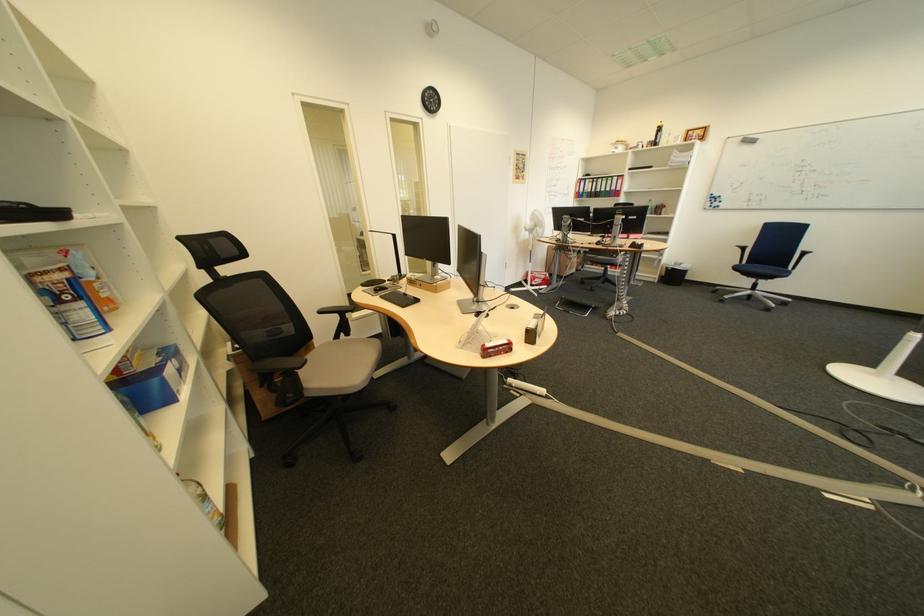
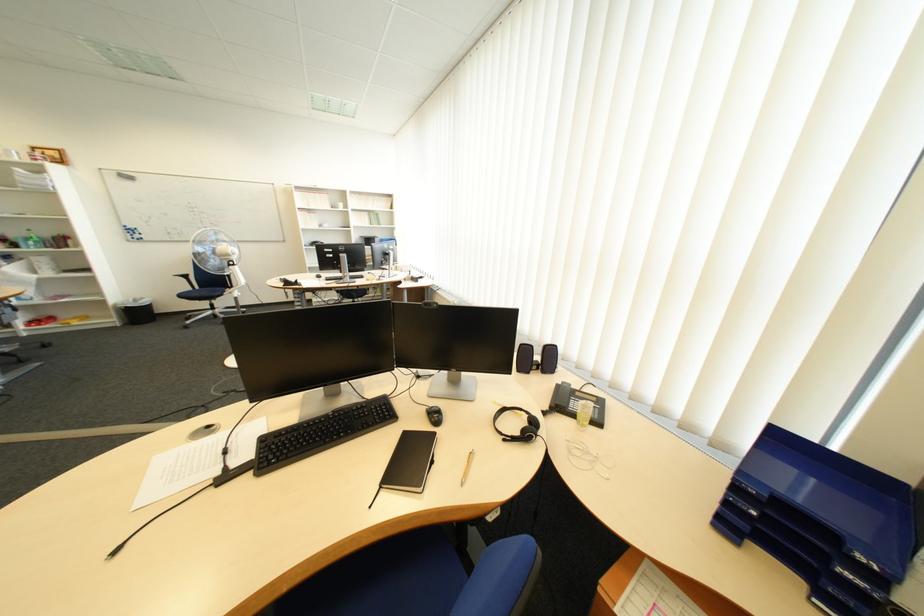
Find the pixel in the second image that matches (x=688, y=265) in the first image.

(149, 302)